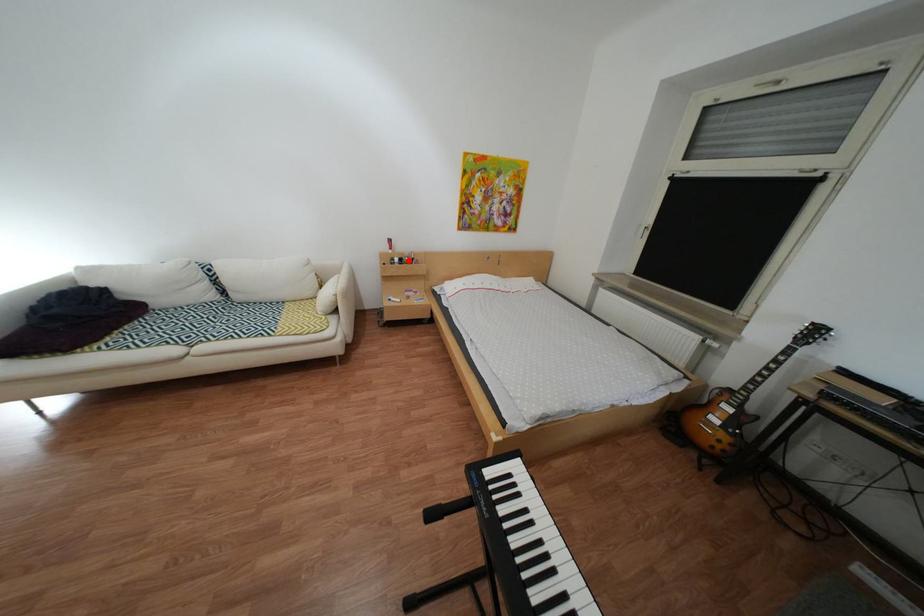
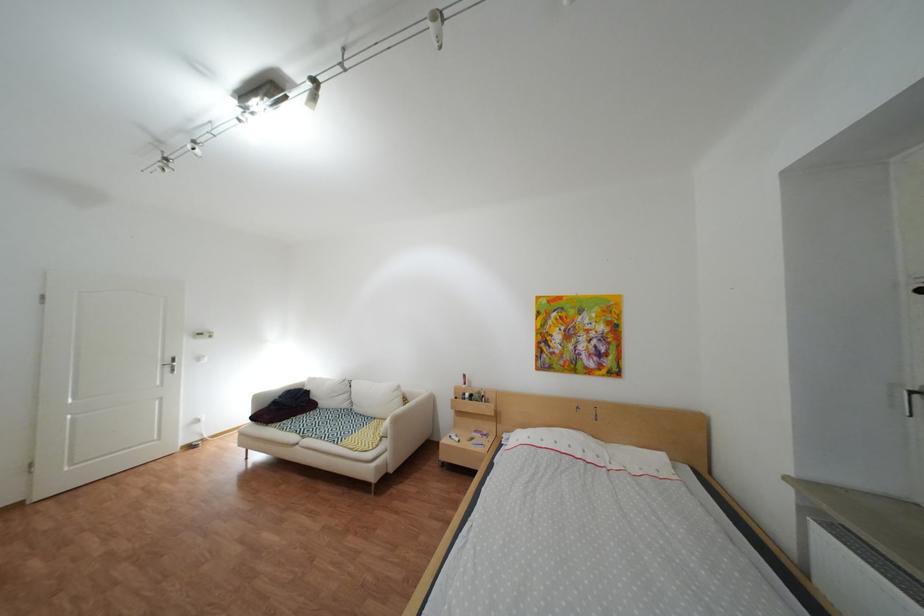
Question: I am providing you with two images of the same scene from different viewpoints. A red point is shown in image1. For the corresponding object point in image2, is it positioned nearer or farther from the camera?

Choices:
 (A) Nearer
 (B) Farther

Answer: (B)